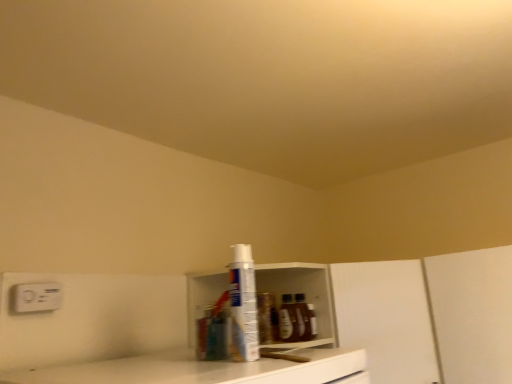
Question: Considering the positions of white plastic electric outlet at upper left and white matte cabinet at center in the image, is white plastic electric outlet at upper left taller or shorter than white matte cabinet at center?

Choices:
 (A) short
 (B) tall

Answer: (A)

Question: Looking at the image, does white plastic electric outlet at upper left seem bigger or smaller compared to white matte cabinet at center?

Choices:
 (A) small
 (B) big

Answer: (A)

Question: Based on their relative distances, which object is nearer to the white plastic spray can at center?

Choices:
 (A) white plastic shelf at center
 (B) white plastic electric outlet at upper left
 (C) white matte cabinet at center

Answer: (A)

Question: Considering the real-world distances, which object is closest to the white plastic electric outlet at upper left?

Choices:
 (A) white plastic spray can at center
 (B) white matte cabinet at center
 (C) white plastic shelf at center

Answer: (A)